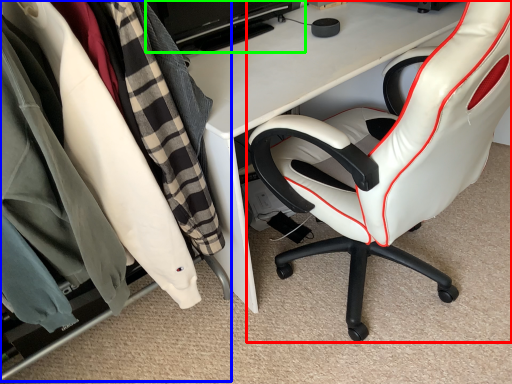
Question: Which object is the closest to the chair (highlighted by a red box)? Choose among these: closet (highlighted by a blue box) or computer monitor (highlighted by a green box).

Choices:
 (A) closet
 (B) computer monitor

Answer: (A)